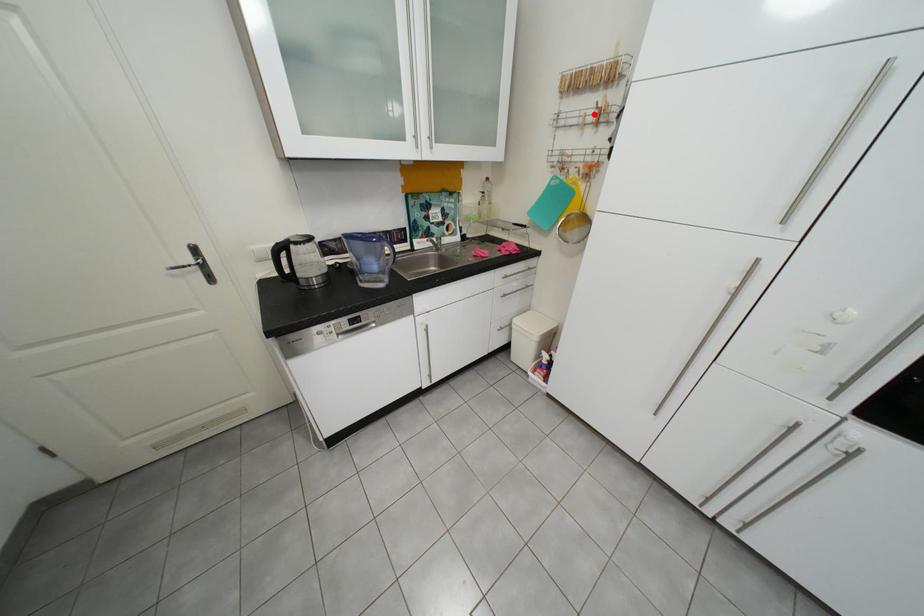
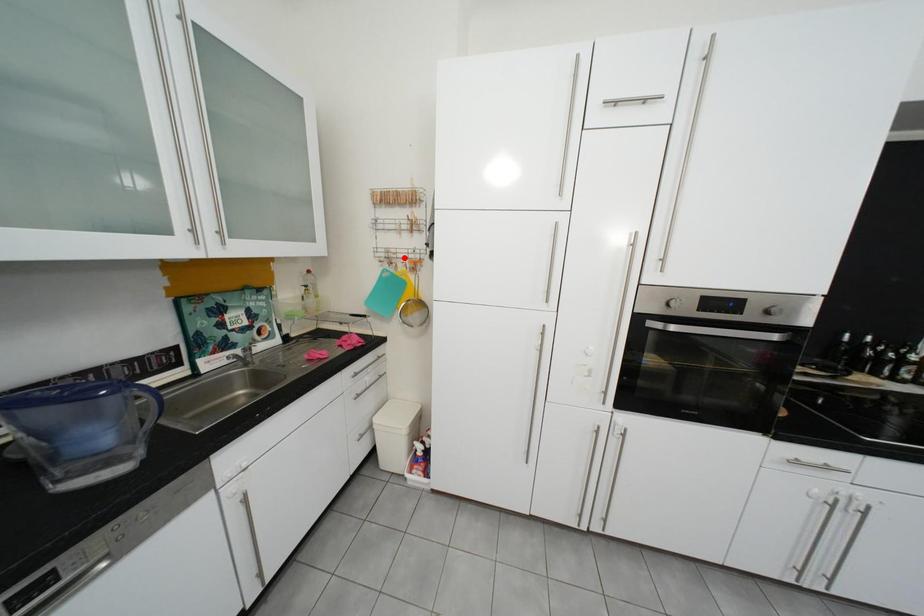
I am providing you with two images of the same scene from different viewpoints. A red point is marked on the first image and another point is marked on the second image. Does the point marked in image1 correspond to the same location as the one in image2?

No